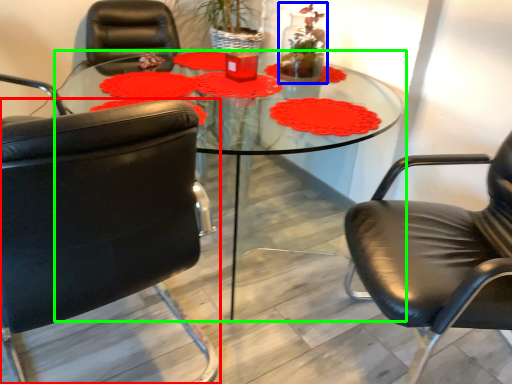
Question: Which object is the farthest from chair (highlighted by a red box)? Choose among these: floral arrangement (highlighted by a blue box) or coffee table (highlighted by a green box).

Choices:
 (A) floral arrangement
 (B) coffee table

Answer: (B)